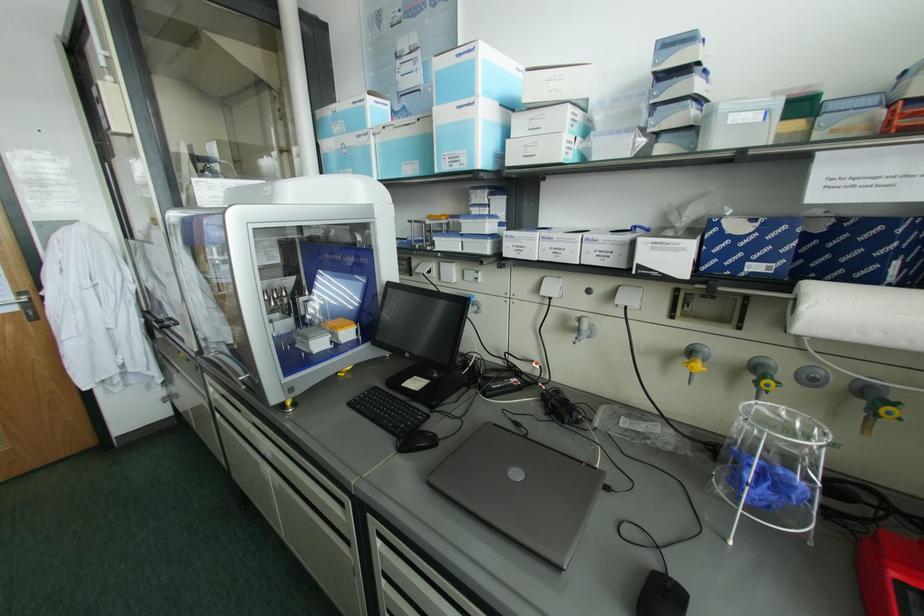
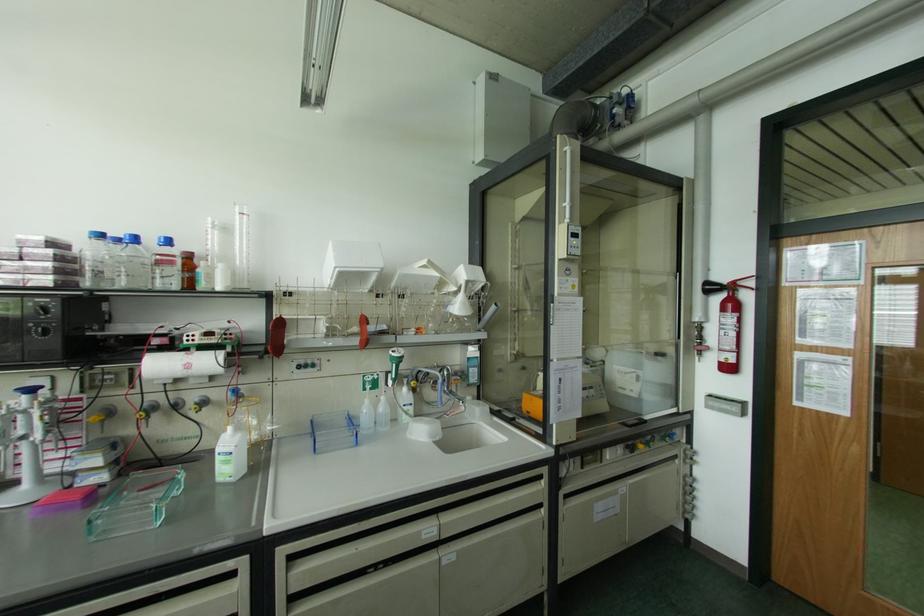
Question: The images are taken continuously from a first-person perspective. In which direction is your viewpoint rotating?

Choices:
 (A) Left
 (B) Right
 (C) Up
 (D) Down

Answer: (A)